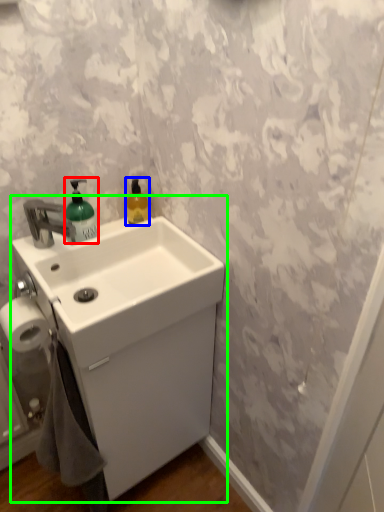
Question: Based on their relative distances, which object is farther from soap dispenser (highlighted by a red box)? Choose from cleaning product (highlighted by a blue box) and sink (highlighted by a green box).

Choices:
 (A) cleaning product
 (B) sink

Answer: (B)